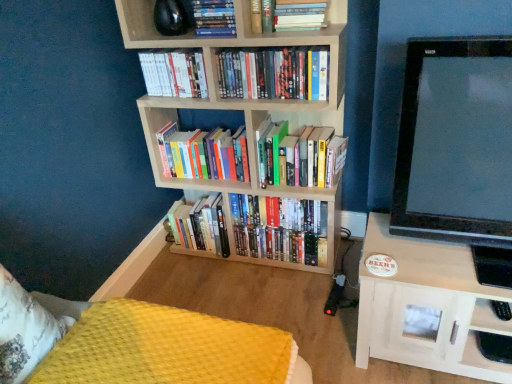
I want to click on vacant point above hardcover books at center, the 6th book viewed from the top (from a real-world perspective), so click(x=294, y=127).